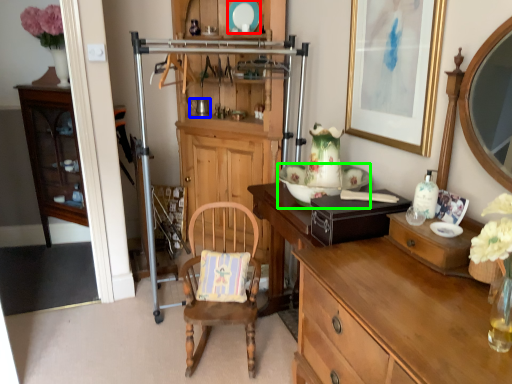
Question: Based on their relative distances, which object is nearer to plate (highlighted by a red box)? Choose from coffee cup (highlighted by a blue box) and plate (highlighted by a green box).

Choices:
 (A) coffee cup
 (B) plate

Answer: (A)